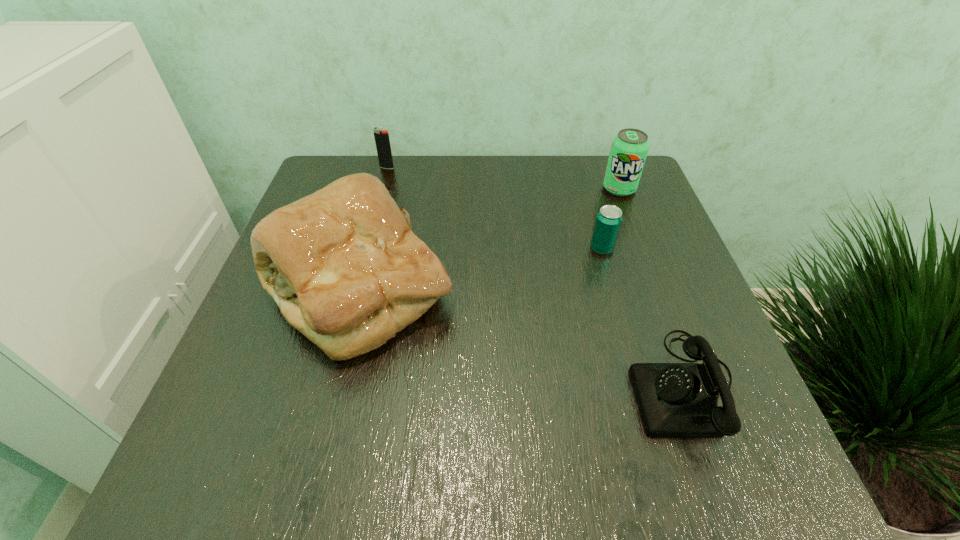
The height and width of the screenshot is (540, 960). In the image, there is a desktop. In order to click on vacant space at the far right corner in this screenshot , I will do `click(579, 165)`.

Where is `vacant region at the near right corner of the desktop`? The height and width of the screenshot is (540, 960). vacant region at the near right corner of the desktop is located at coordinates (674, 464).

Find the location of a particular element. Image resolution: width=960 pixels, height=540 pixels. free space between the telephone and the tallest object is located at coordinates (521, 338).

I want to click on free space that is in between the telephone and the fourth shortest object, so click(x=652, y=287).

Locate an element on the screen. empty space between the beer can and the telephone is located at coordinates (643, 317).

This screenshot has width=960, height=540. Identify the location of vacant region between the second farthest object and the telephone. (652, 287).

You are a GUI agent. You are given a task and a screenshot of the screen. Output one action in this format:
    pyautogui.click(x=<x>, y=<y>)
    Task: Click on the free space between the beer can and the telephone
    
    Given the screenshot: What is the action you would take?
    pyautogui.click(x=643, y=317)

Locate an element on the screen. The width and height of the screenshot is (960, 540). vacant space that is in between the pop soda and the telephone is located at coordinates (652, 287).

Find the location of a particular element. This screenshot has height=540, width=960. vacant space in between the tallest object and the fourth nearest object is located at coordinates (490, 239).

This screenshot has height=540, width=960. In order to click on vacant area that lies between the telephone and the igniter in this screenshot , I will do `click(536, 276)`.